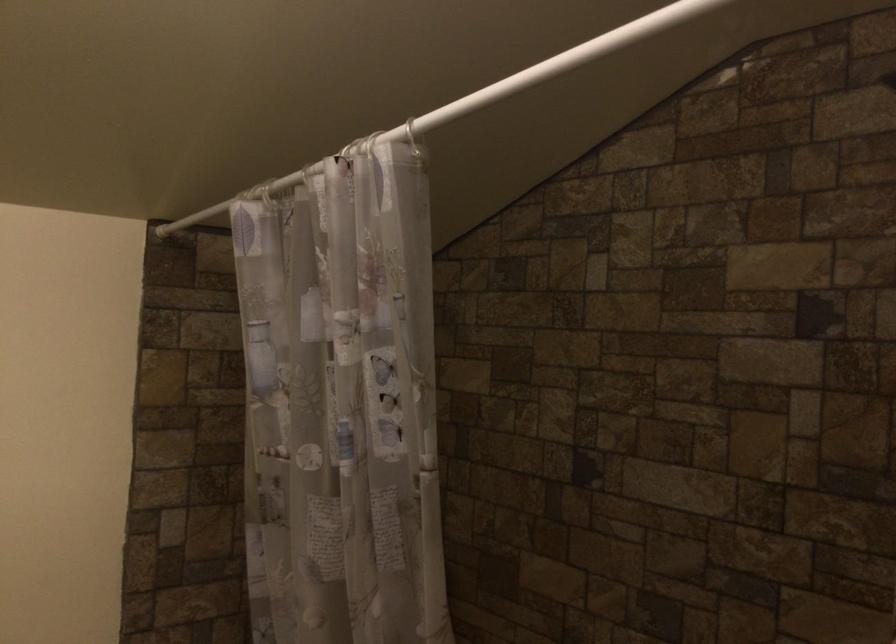
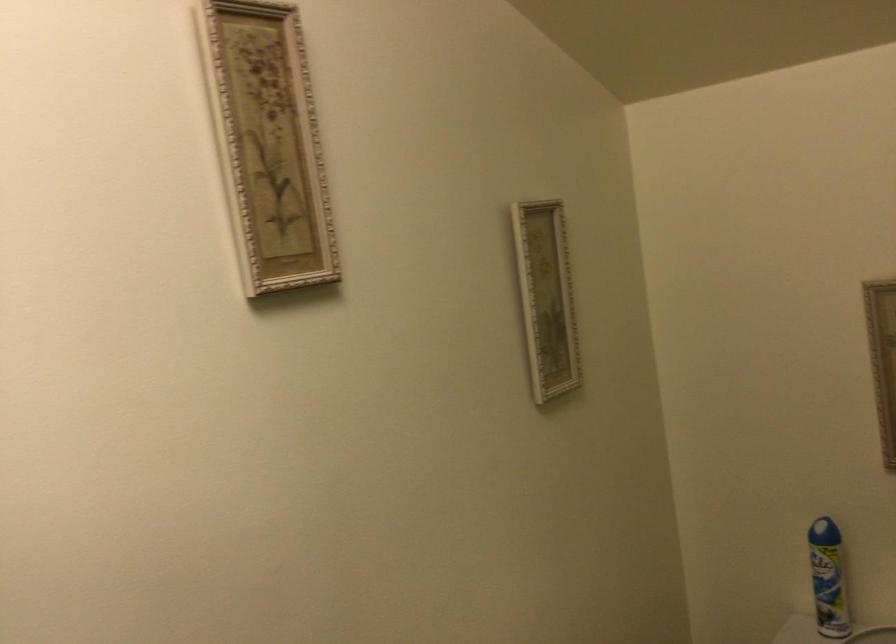
Question: Based on the continuous images, in which direction is the camera rotating? Reply with the corresponding letter.

Choices:
 (A) Left
 (B) Right
 (C) Up
 (D) Down

Answer: (A)